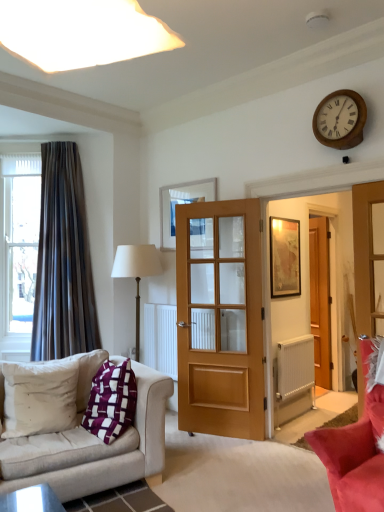
Where is `free point below white textured radiator at lower right (from a real-world perspective)`? This screenshot has height=512, width=384. free point below white textured radiator at lower right (from a real-world perspective) is located at coordinates (296, 417).